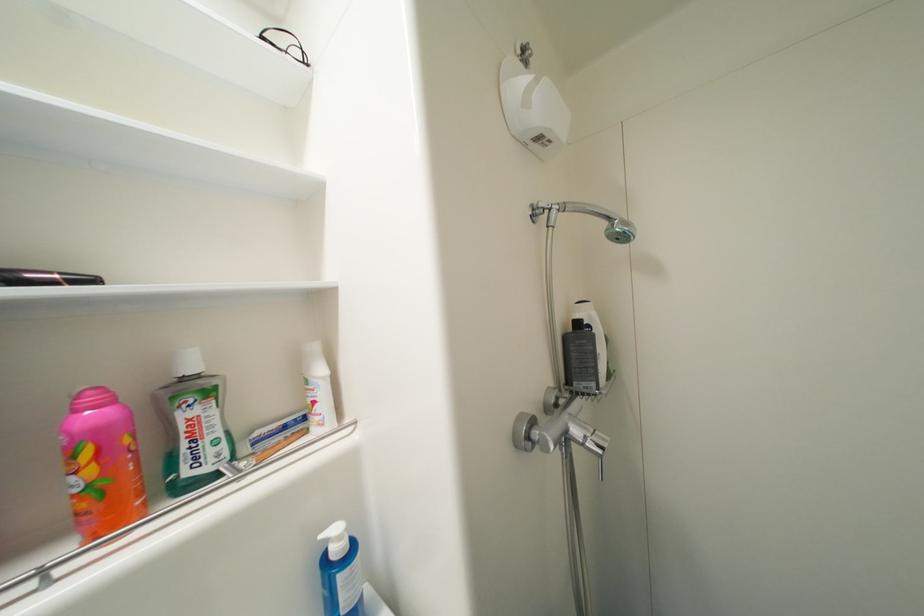
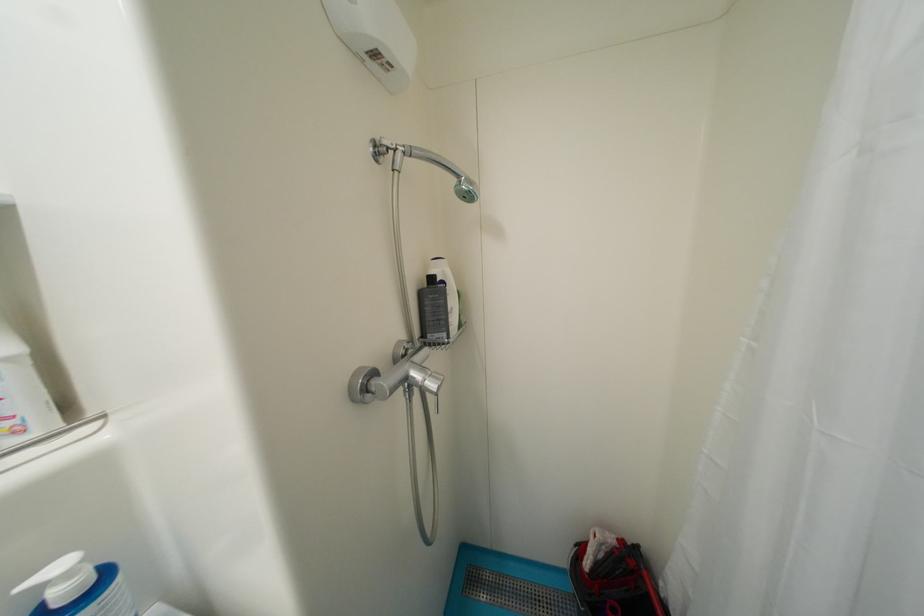
The point at (585,326) is marked in the first image. Where is the corresponding point in the second image?

(439, 281)